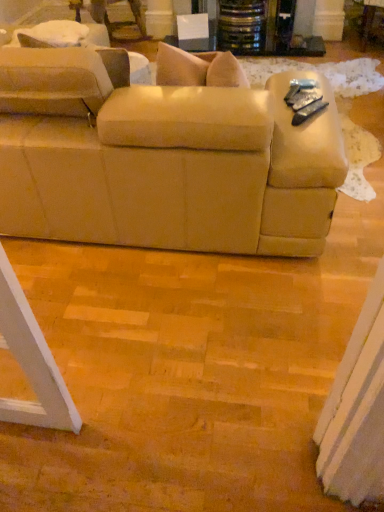
What do you see at coordinates (164, 162) in the screenshot? The image size is (384, 512). I see `beige fabric couch at center` at bounding box center [164, 162].

The height and width of the screenshot is (512, 384). Identify the location of beige fabric couch at center. 164,162.

This screenshot has height=512, width=384. I want to click on beige fabric couch at center, so click(164, 162).